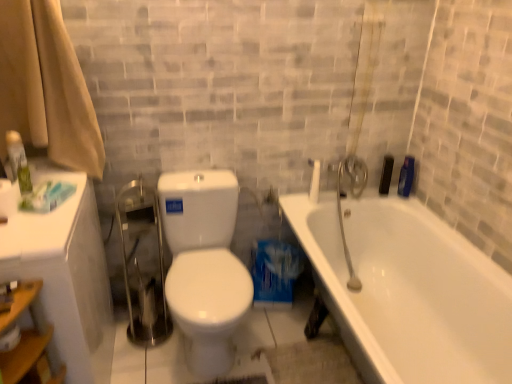
Image resolution: width=512 pixels, height=384 pixels. What are the coordinates of `free point below white glossy toilet at center (from a real-world perspective)` in the screenshot? It's located at (252, 348).